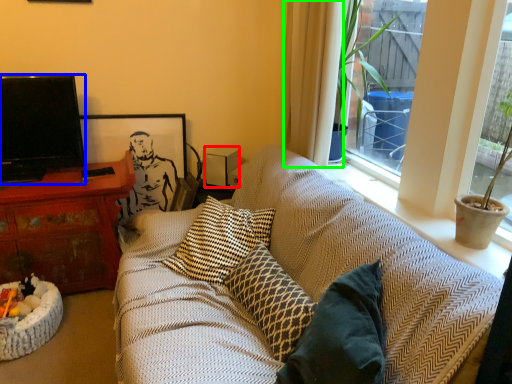
Question: Based on their relative distances, which object is nearer to loudspeaker (highlighted by a red box)? Choose from television (highlighted by a blue box) and curtain (highlighted by a green box).

Choices:
 (A) television
 (B) curtain

Answer: (B)